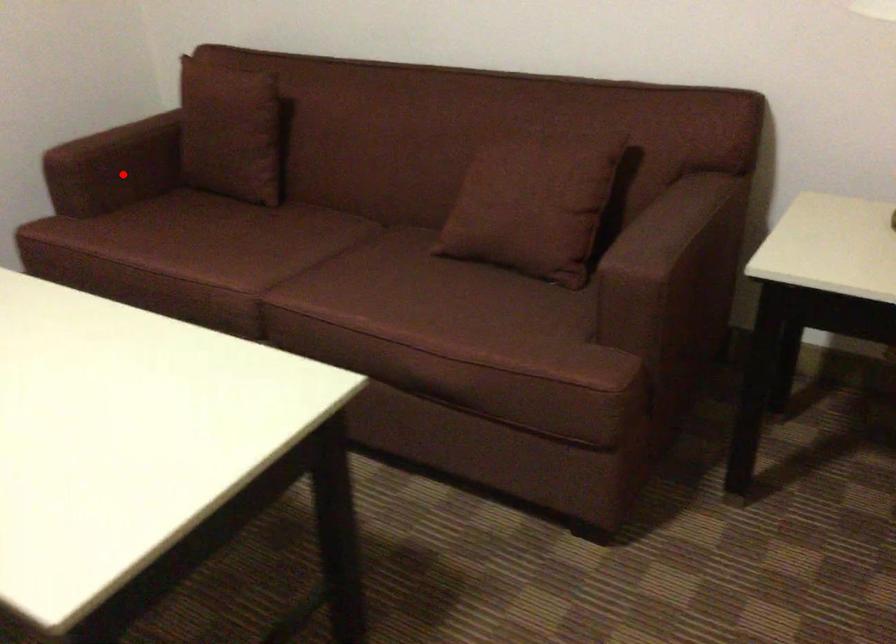
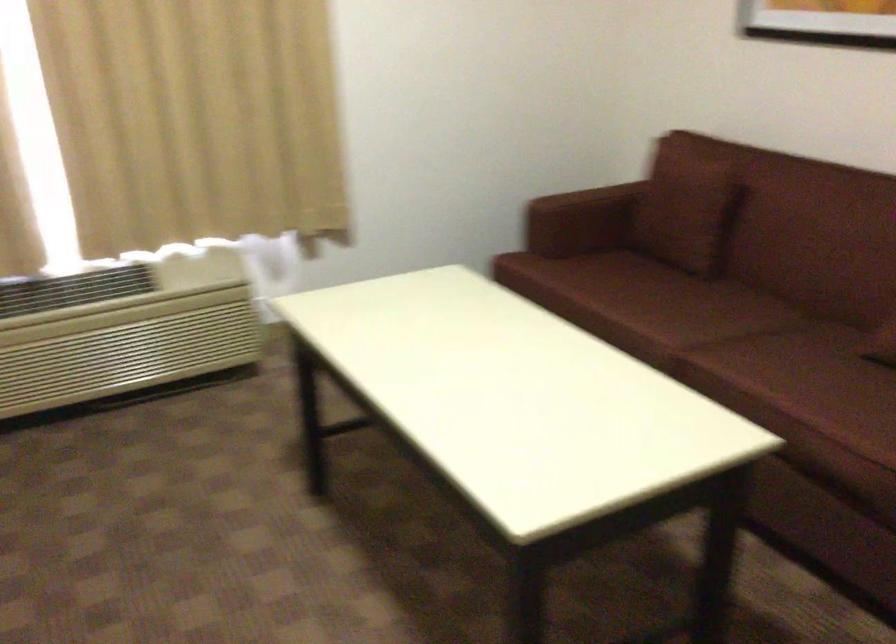
Where in the second image is the point corresponding to the highlighted location from the first image?

(573, 225)